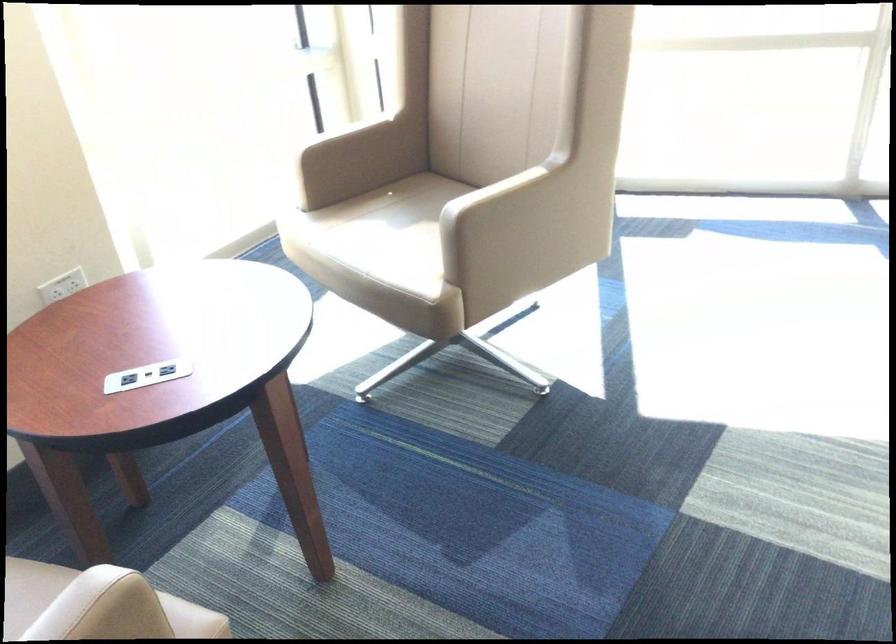
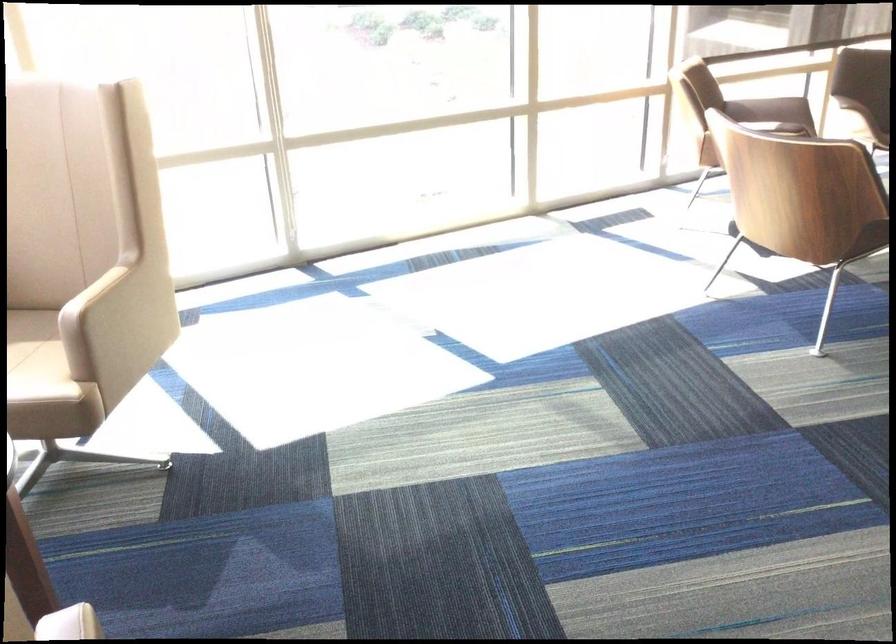
Question: The camera is either moving clockwise (left) or counter-clockwise (right) around the object. The first image is from the beginning of the video and the second image is from the end. Is the camera moving left or right when shooting the video?

Choices:
 (A) Left
 (B) Right

Answer: (A)